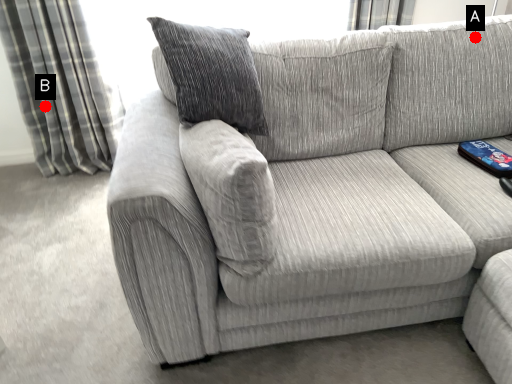
Question: Two points are circled on the image, labeled by A and B beside each circle. Which of the following is the closest to the observer?

Choices:
 (A) A is closer
 (B) B is closer

Answer: (A)